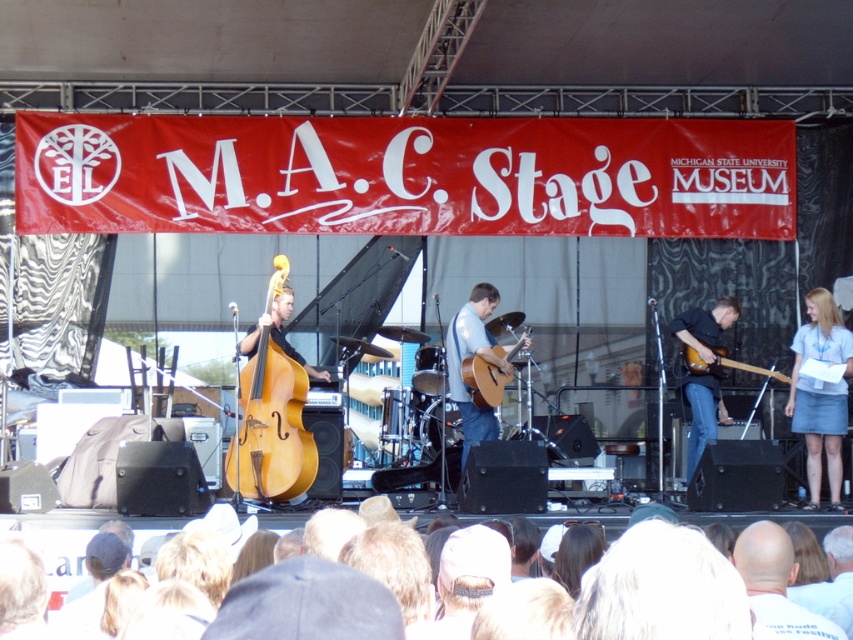
Image resolution: width=853 pixels, height=640 pixels. Describe the element at coordinates (55, 540) in the screenshot. I see `white cotton crowd at lower center` at that location.

Does white cotton crowd at lower center have a larger size compared to wooden acoustic guitar at center?

No.

This screenshot has height=640, width=853. What do you see at coordinates (55, 540) in the screenshot?
I see `white cotton crowd at lower center` at bounding box center [55, 540].

Identify the location of white cotton crowd at lower center. (55, 540).

Is white cotton crowd at lower center to the left of glossy wood electric guitar at right from the viewer's perspective?

Indeed, white cotton crowd at lower center is positioned on the left side of glossy wood electric guitar at right.

Where is `white cotton crowd at lower center`? This screenshot has height=640, width=853. white cotton crowd at lower center is located at coordinates (55, 540).

Is point (781, 612) closer to viewer compared to point (682, 323)?

Yes.

Which is above, bald head at center or shiny black guitar at center?

shiny black guitar at center is above.

Who is more forward, (756, 618) or (686, 330)?

Point (756, 618) is more forward.

Where is `bald head at center`? The width and height of the screenshot is (853, 640). bald head at center is located at coordinates (776, 582).